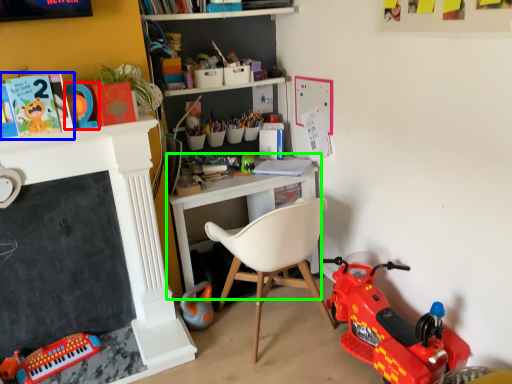
Question: Estimate the real-world distances between objects in this image. Which object is farther from toy (highlighted by a red box), book (highlighted by a blue box) or shelf (highlighted by a green box)?

Choices:
 (A) book
 (B) shelf

Answer: (B)